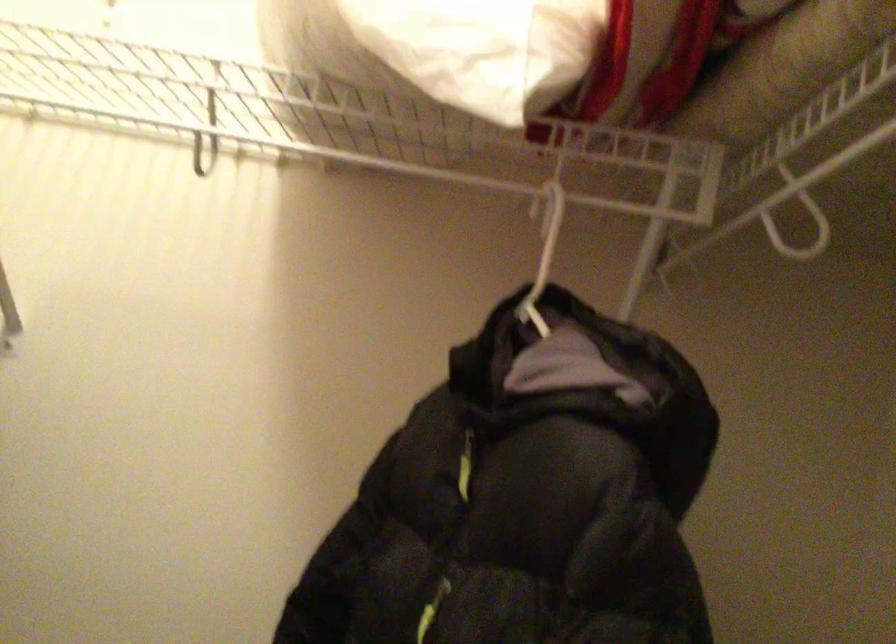
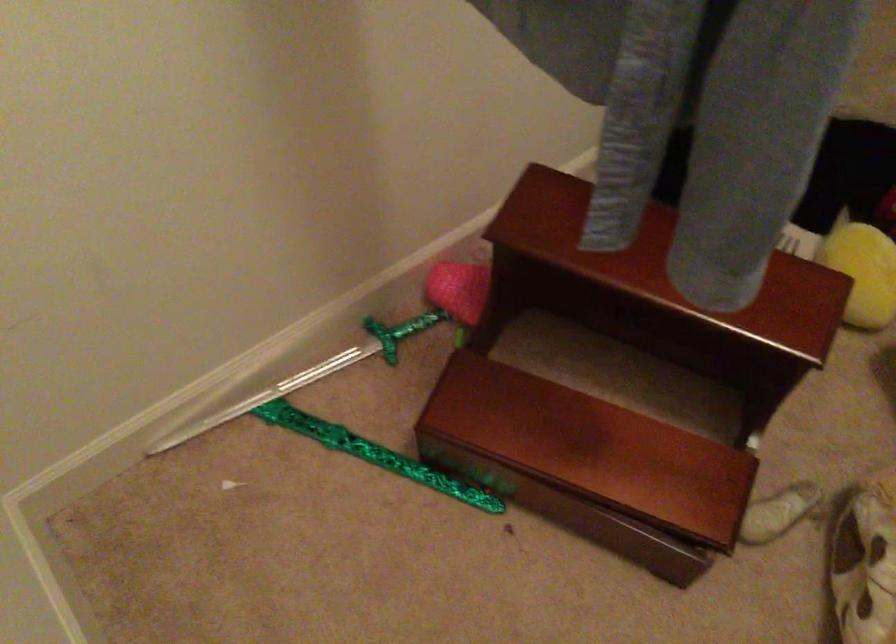
Question: The first image is from the beginning of the video and the second image is from the end. How did the camera likely rotate when shooting the video?

Choices:
 (A) Left
 (B) Right
 (C) Up
 (D) Down

Answer: (D)